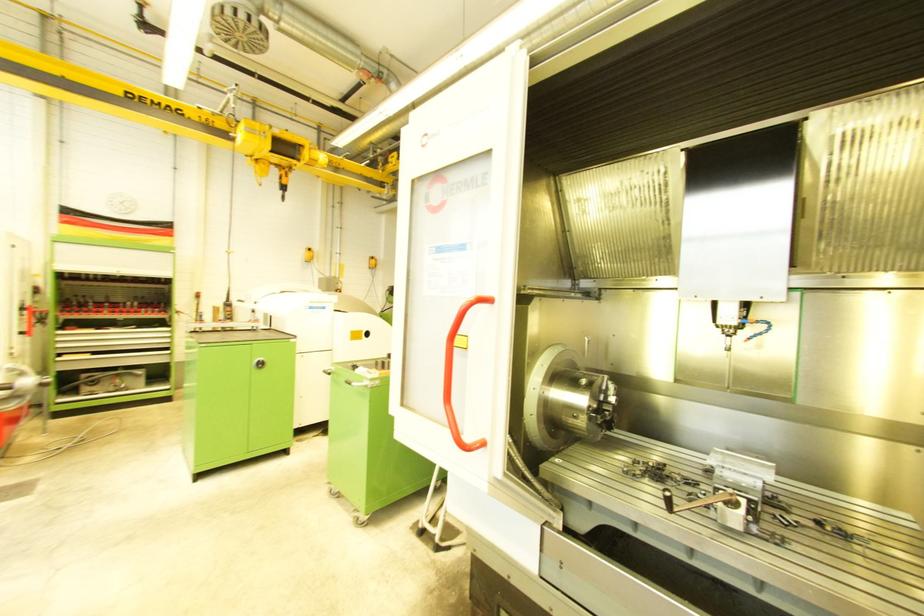
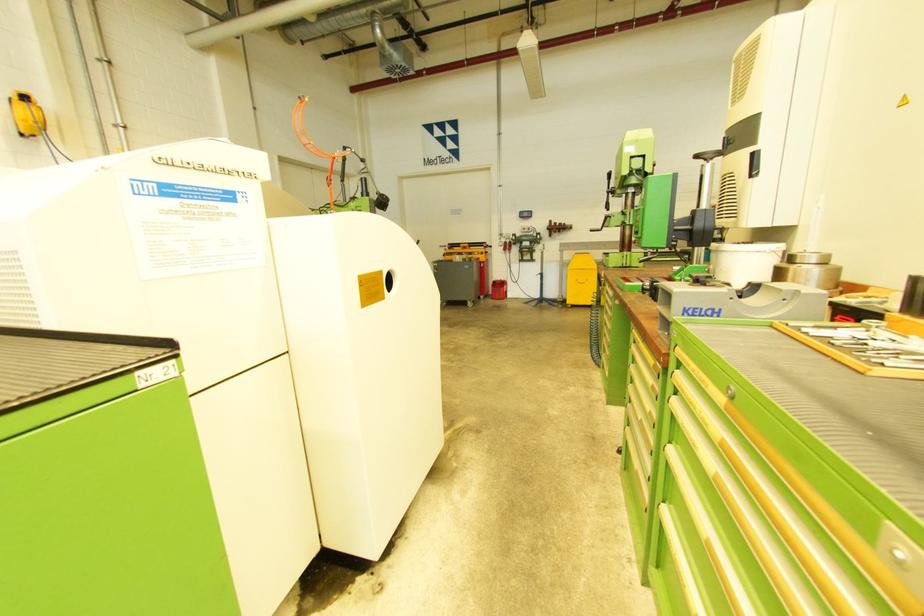
What movement of the cameraman would produce the second image?

The movement direction of the cameraman is left, forward.